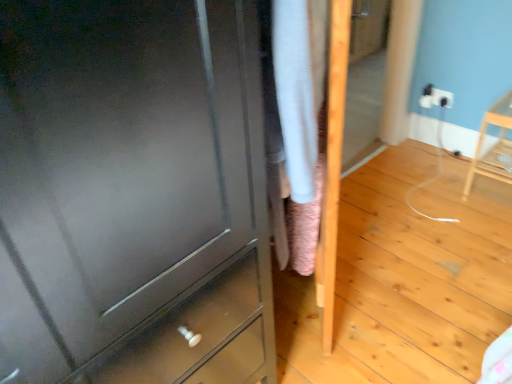
Question: Can you see white plastic electric outlet at upper right touching light wood chair at right?

Choices:
 (A) yes
 (B) no

Answer: (B)

Question: Is white plastic electric outlet at upper right behind light wood chair at right?

Choices:
 (A) no
 (B) yes

Answer: (B)

Question: Considering the relative positions of white plastic electric outlet at upper right and light wood chair at right in the image provided, is white plastic electric outlet at upper right to the left of light wood chair at right from the viewer's perspective?

Choices:
 (A) no
 (B) yes

Answer: (B)

Question: Can you confirm if white plastic electric outlet at upper right is smaller than light wood chair at right?

Choices:
 (A) no
 (B) yes

Answer: (B)

Question: Is white plastic electric outlet at upper right closer to the viewer compared to light wood chair at right?

Choices:
 (A) yes
 (B) no

Answer: (B)

Question: Considering the relative positions of white plastic electric outlet at upper right and light wood chair at right in the image provided, is white plastic electric outlet at upper right to the right of light wood chair at right from the viewer's perspective?

Choices:
 (A) no
 (B) yes

Answer: (A)

Question: Does matte gray chest of drawers at center appear on the left side of light wood chair at right?

Choices:
 (A) yes
 (B) no

Answer: (A)

Question: Is matte gray chest of drawers at center far from light wood chair at right?

Choices:
 (A) yes
 (B) no

Answer: (A)

Question: Can you confirm if matte gray chest of drawers at center is wider than light wood chair at right?

Choices:
 (A) no
 (B) yes

Answer: (B)

Question: Would you say light wood chair at right is part of matte gray chest of drawers at center's contents?

Choices:
 (A) no
 (B) yes

Answer: (A)

Question: From the image's perspective, is matte gray chest of drawers at center located beneath light wood chair at right?

Choices:
 (A) yes
 (B) no

Answer: (A)

Question: Is matte gray chest of drawers at center located outside light wood chair at right?

Choices:
 (A) yes
 (B) no

Answer: (A)

Question: Is light wood chair at right to the right of matte gray chest of drawers at center from the viewer's perspective?

Choices:
 (A) no
 (B) yes

Answer: (B)